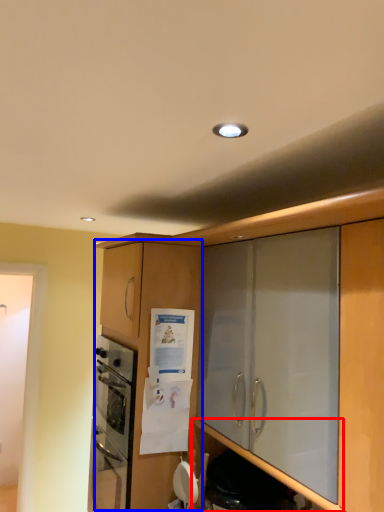
Question: Which object is closer to the camera taking this photo, shelf (highlighted by a red box) or cabinetry (highlighted by a blue box)?

Choices:
 (A) shelf
 (B) cabinetry

Answer: (A)